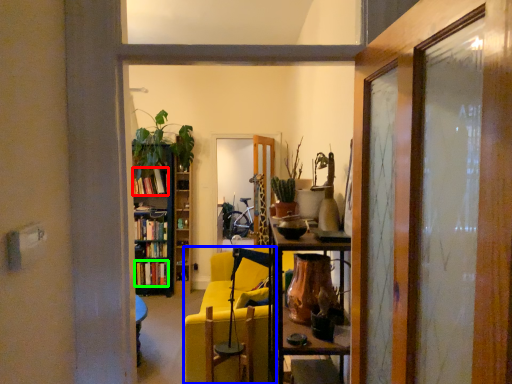
Question: Considering the real-world distances, which object is closest to book (highlighted by a red box)? chair (highlighted by a blue box) or book (highlighted by a green box).

Choices:
 (A) chair
 (B) book

Answer: (B)